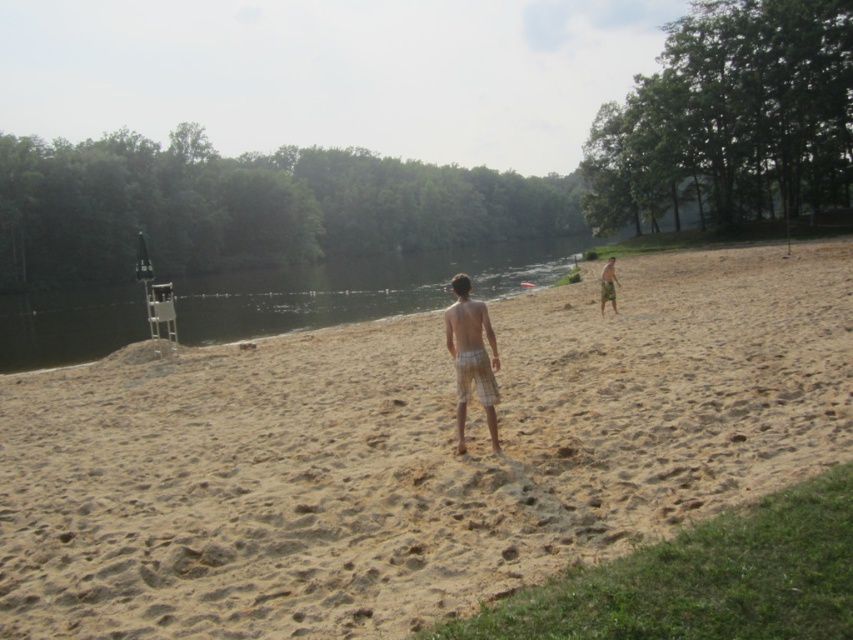
Question: Is brown sandy beach at center thinner than beige plaid shorts at center?

Choices:
 (A) no
 (B) yes

Answer: (A)

Question: Which point is closer to the camera taking this photo?

Choices:
 (A) (602, 278)
 (B) (605, 364)

Answer: (B)

Question: Is brown sandy beach at center positioned before clear water at center?

Choices:
 (A) yes
 (B) no

Answer: (A)

Question: Estimate the real-world distances between objects in this image. Which object is farther from the beige plaid shorts at center?

Choices:
 (A) brown sandy beach at center
 (B) clear water at center
 (C) white plaid shorts at center

Answer: (B)

Question: Considering the real-world distances, which object is closest to the beige plaid shorts at center?

Choices:
 (A) white plaid shorts at center
 (B) clear water at center
 (C) brown sandy beach at center

Answer: (C)

Question: Does brown sandy beach at center have a larger size compared to clear water at center?

Choices:
 (A) yes
 (B) no

Answer: (B)